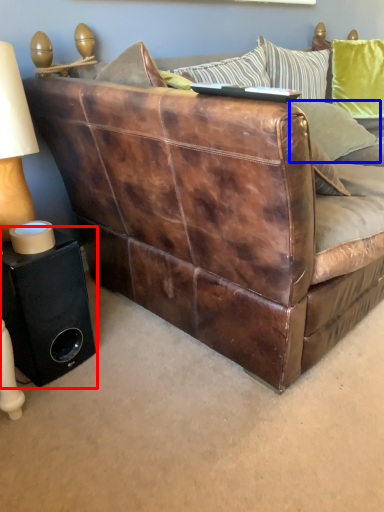
Question: Which point is closer to the camera, speaker (highlighted by a red box) or pillow (highlighted by a blue box)?

Choices:
 (A) speaker
 (B) pillow

Answer: (A)